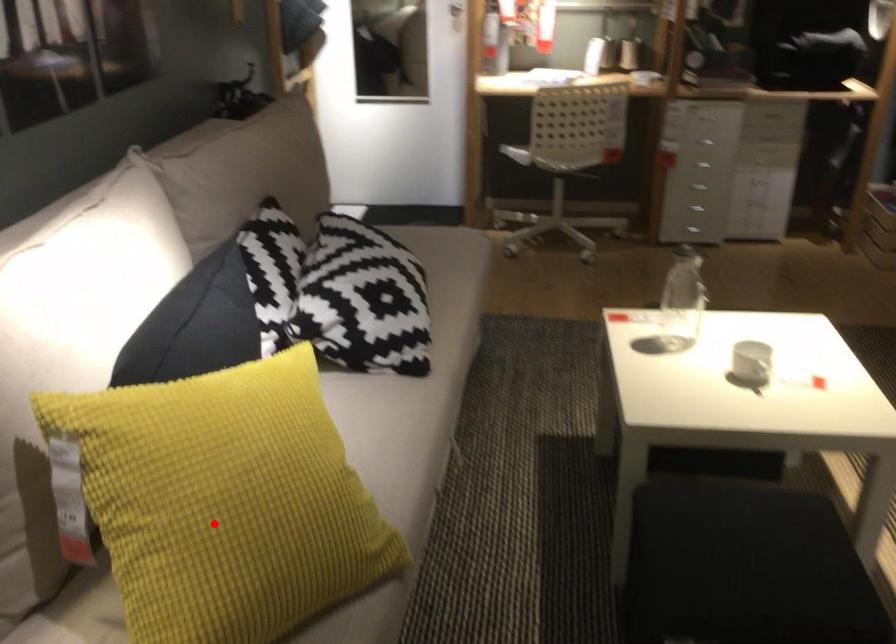
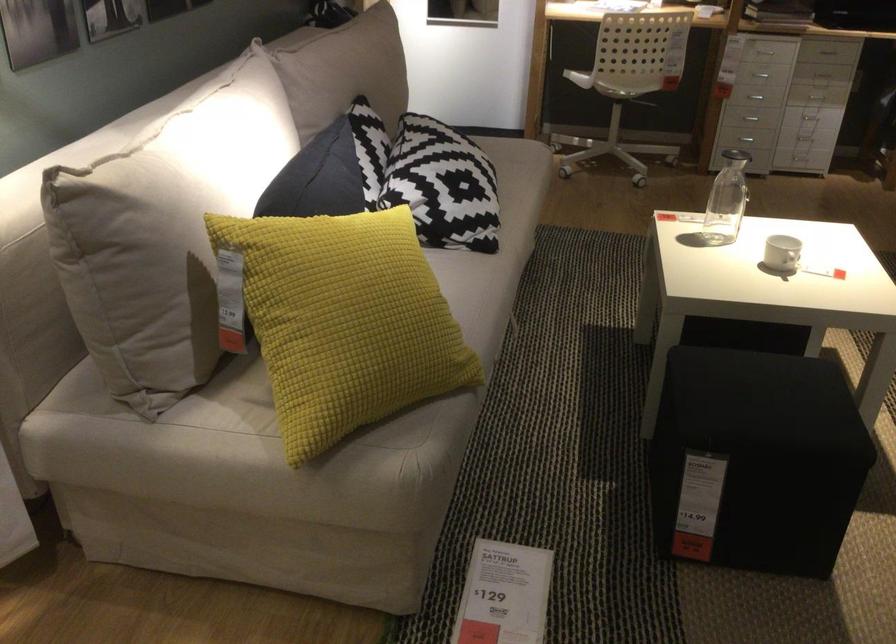
Question: I am providing you with two images of the same scene from different viewpoints. A red point is marked on the first image. Can you still see the location of the red point in image 2?

Choices:
 (A) Yes
 (B) No

Answer: (A)